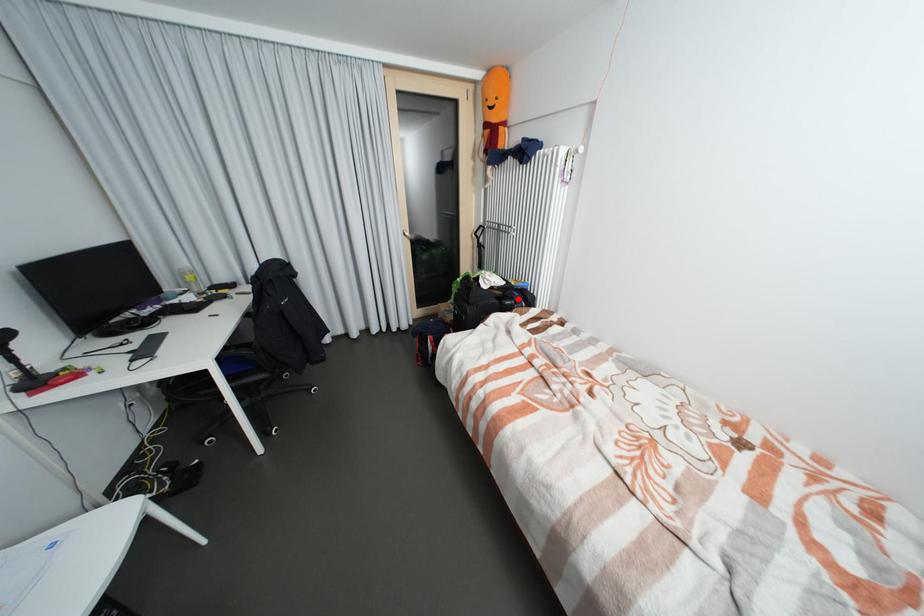
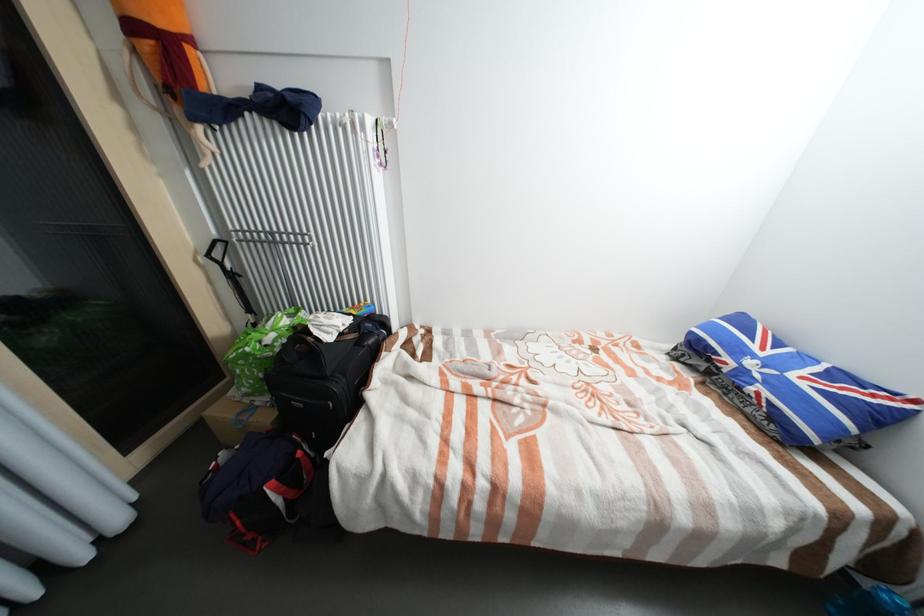
Find the pixel in the second image that matches the highlighted location in the first image.

(377, 334)